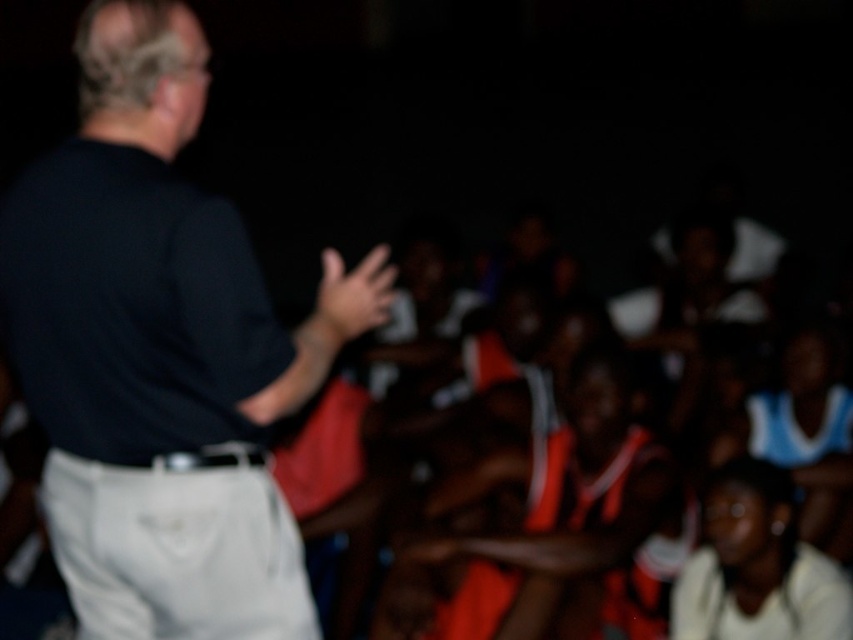
Which is more to the right, black matte shirt at upper left or white matte shirt at lower right?

From the viewer's perspective, white matte shirt at lower right appears more on the right side.

Who is more distant from viewer, (73,154) or (833,609)?

Point (833,609)

This screenshot has width=853, height=640. Find the location of `black matte shirt at upper left`. black matte shirt at upper left is located at coordinates (152, 355).

Which is above, white matte shirt at lower right or matte black hand at center?

matte black hand at center is above.

Can you confirm if white matte shirt at lower right is smaller than matte black hand at center?

Incorrect, white matte shirt at lower right is not smaller in size than matte black hand at center.

Identify the location of white matte shirt at lower right. (757, 566).

The height and width of the screenshot is (640, 853). What do you see at coordinates (152, 355) in the screenshot?
I see `black matte shirt at upper left` at bounding box center [152, 355].

Does black matte shirt at upper left have a greater width compared to matte black hand at center?

Yes, black matte shirt at upper left is wider than matte black hand at center.

Is point (138, 346) positioned before point (364, 296)?

Yes.

What are the coordinates of `black matte shirt at upper left` in the screenshot? It's located at (152, 355).